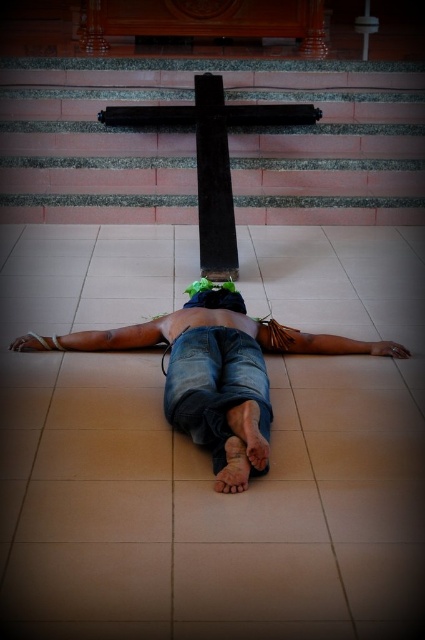
Question: Is blue denim jeans at center below black polished wood cross at center?

Choices:
 (A) yes
 (B) no

Answer: (A)

Question: Which point appears closest to the camera in this image?

Choices:
 (A) (150, 122)
 (B) (232, 288)

Answer: (B)

Question: Where is blue denim jeans at center located in relation to green fabric head at center in the image?

Choices:
 (A) right
 (B) left

Answer: (B)

Question: Which object is the farthest from the green fabric head at center?

Choices:
 (A) blue denim jeans at center
 (B) black polished wood cross at center

Answer: (B)

Question: Can you confirm if blue denim jeans at center is wider than black polished wood crucifix at center?

Choices:
 (A) no
 (B) yes

Answer: (B)

Question: Which point appears closest to the camera in this image?

Choices:
 (A) (209, 285)
 (B) (274, 342)

Answer: (B)